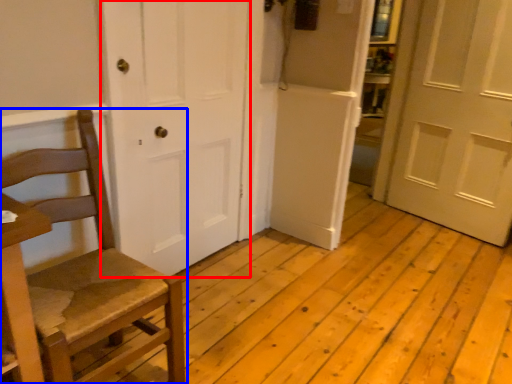
Question: Which object is closer to the camera taking this photo, door (highlighted by a red box) or chair (highlighted by a blue box)?

Choices:
 (A) door
 (B) chair

Answer: (B)